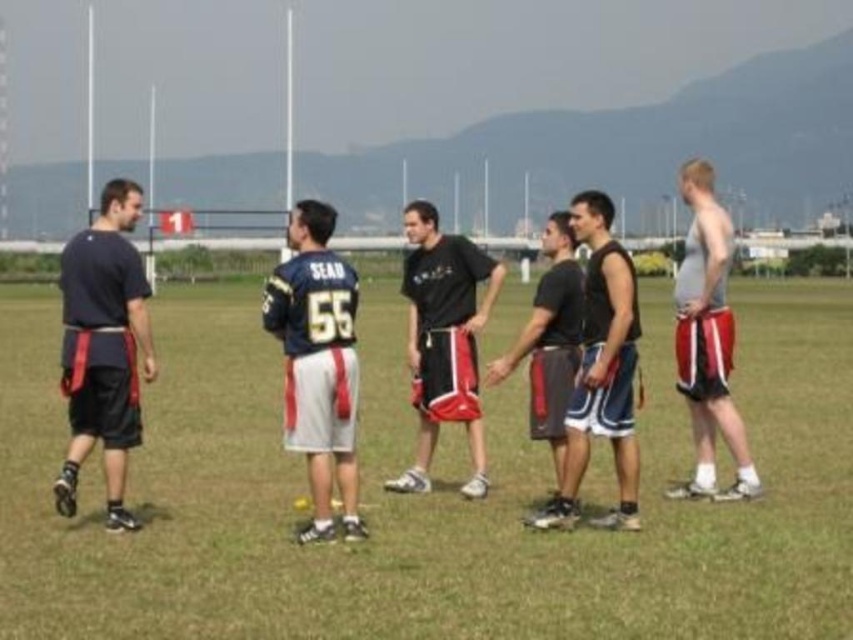
Question: Can you confirm if green grass football field at center is bigger than black matte shorts at center?

Choices:
 (A) no
 (B) yes

Answer: (B)

Question: Estimate the real-world distances between objects in this image. Which object is farther from the dark gray fabric shorts at center?

Choices:
 (A) blue jersey at center
 (B) black matte shorts at center
 (C) gray matte shorts at right
 (D) dark gray shorts at center

Answer: (A)

Question: Does blue jersey at center lie behind black matte shorts at center?

Choices:
 (A) yes
 (B) no

Answer: (B)

Question: Can you confirm if dark gray shorts at center is positioned below dark gray fabric shorts at center?

Choices:
 (A) no
 (B) yes

Answer: (A)

Question: Which point appears farthest from the camera in this image?

Choices:
 (A) (537, 387)
 (B) (285, 433)
 (C) (480, 429)
 (D) (679, 316)

Answer: (C)

Question: Which point is farther to the camera?

Choices:
 (A) black matte shorts at center
 (B) green grass football field at center
 (C) blue jersey at center
 (D) gray matte shorts at right

Answer: (A)